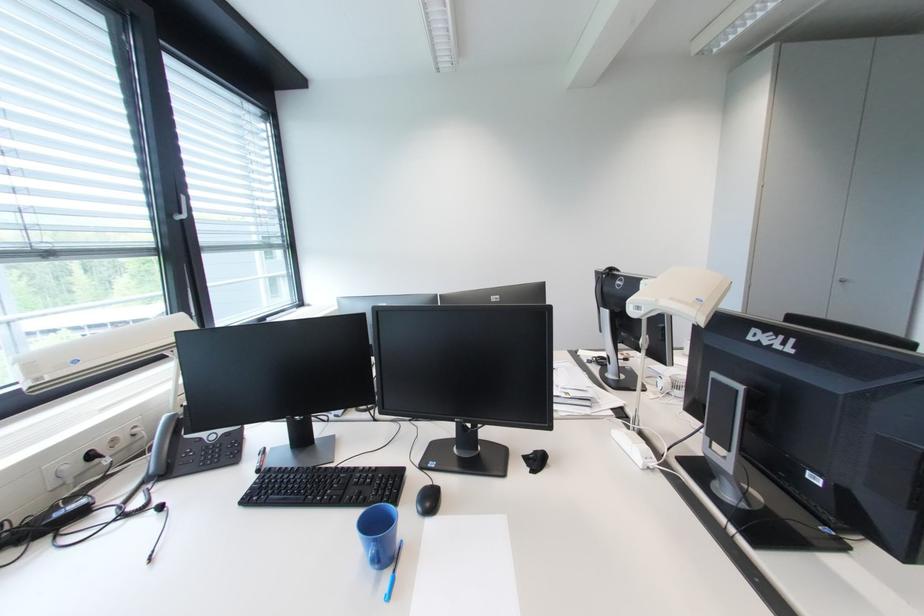
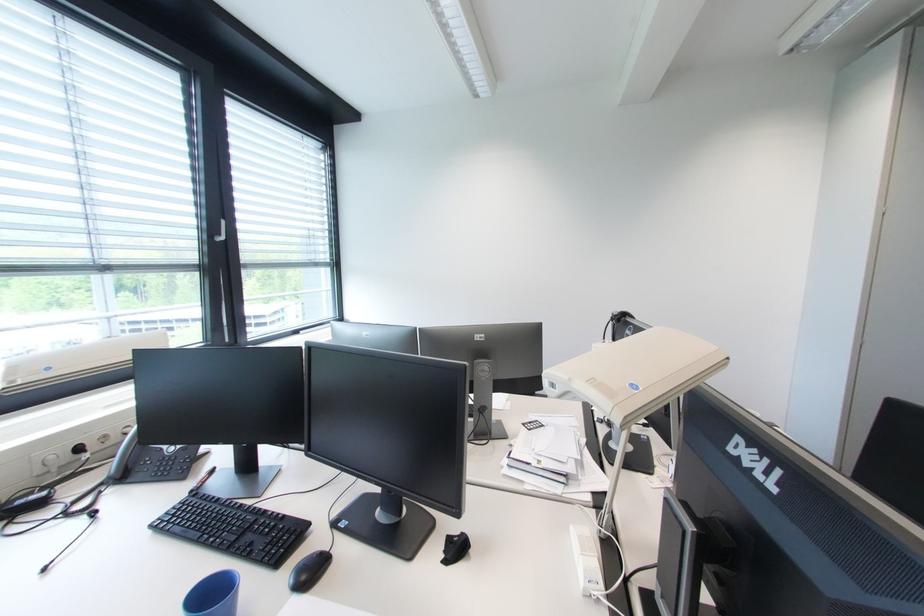
Locate, in the second image, the point that corresponds to point (141, 429) in the first image.

(134, 428)